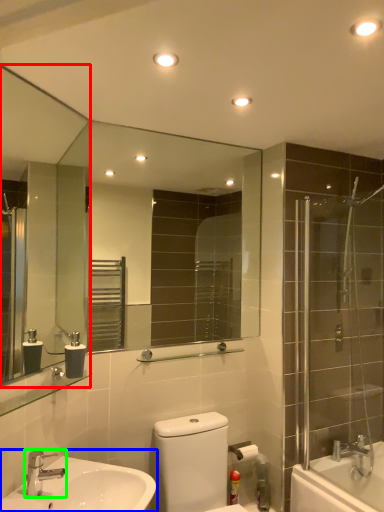
Question: Considering the real-world distances, which object is closest to mirror (highlighted by a red box)? sink (highlighted by a blue box) or tap (highlighted by a green box).

Choices:
 (A) sink
 (B) tap

Answer: (A)